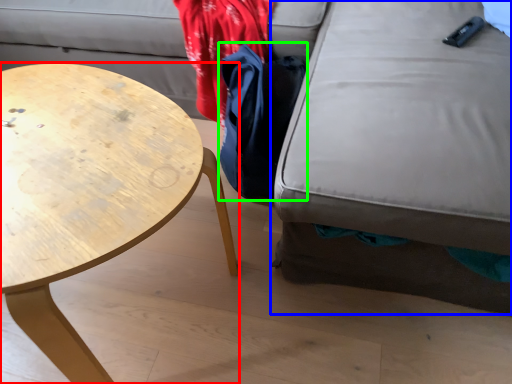
Question: Which is farther away from coffee table (highlighted by a red box)? swivel chair (highlighted by a blue box) or cloak (highlighted by a green box)?

Choices:
 (A) swivel chair
 (B) cloak

Answer: (A)